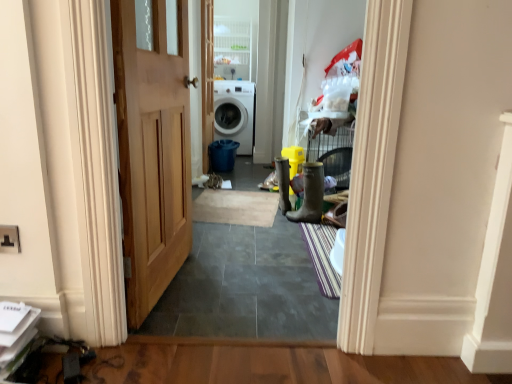
This screenshot has width=512, height=384. Identify the location of free area in between rubber boot at center, the first boot in the back-to-front sequence, and wooden door at left. (224, 252).